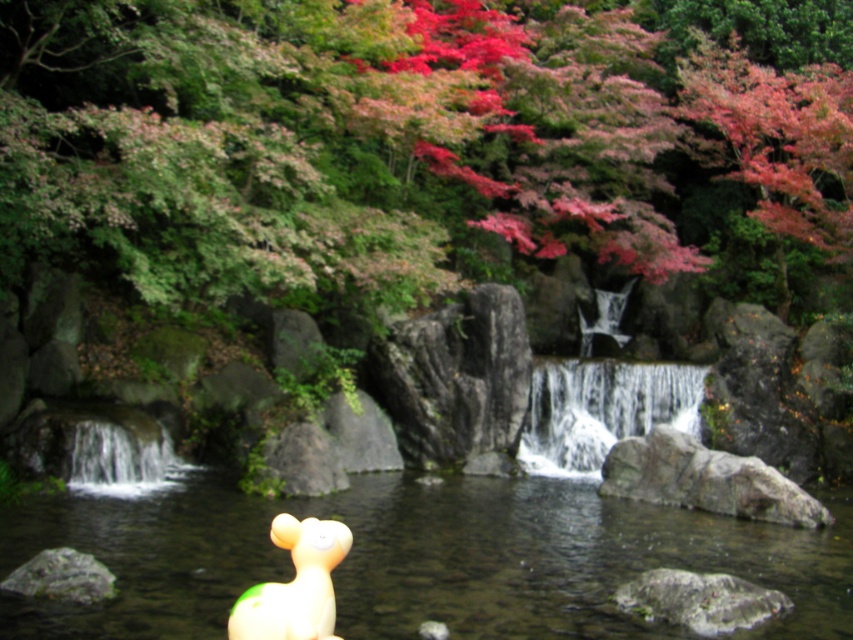
Question: Which point appears closest to the camera in this image?

Choices:
 (A) (102, 563)
 (B) (154, 456)
 (C) (529, 444)

Answer: (A)

Question: Estimate the real-world distances between objects in this image. Which object is farther from the green matte tree at upper center?

Choices:
 (A) white frothy water at lower left
 (B) clear water at center

Answer: (A)

Question: Which point is farther to the camera?

Choices:
 (A) (97, 584)
 (B) (248, 621)
 (C) (671, 456)
 (D) (796, 544)

Answer: (C)

Question: Does translucent yellow duckling at lower left have a lesser width compared to white frothy water at lower left?

Choices:
 (A) yes
 (B) no

Answer: (A)

Question: Is gray rough rock at lower right positioned before white frothy water at lower left?

Choices:
 (A) no
 (B) yes

Answer: (B)

Question: Can you confirm if clear water at center is positioned to the left of gray rough rock at lower left?

Choices:
 (A) yes
 (B) no

Answer: (B)